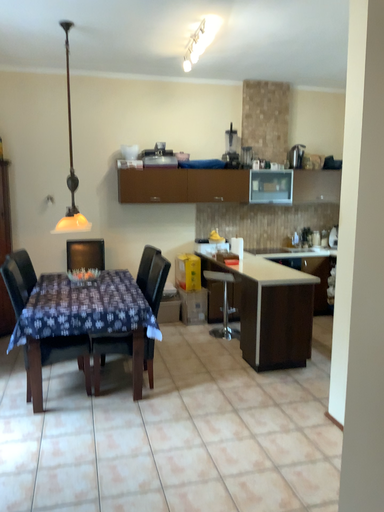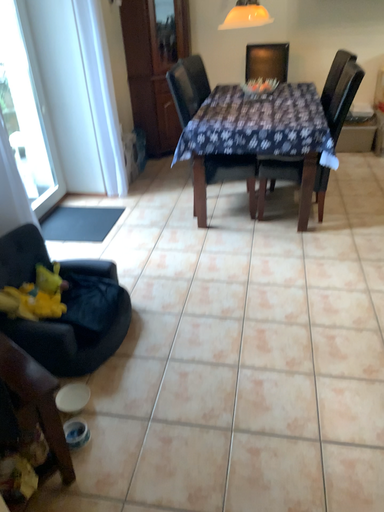
Question: Which way did the camera rotate in the video?

Choices:
 (A) rotated upward
 (B) rotated downward

Answer: (B)